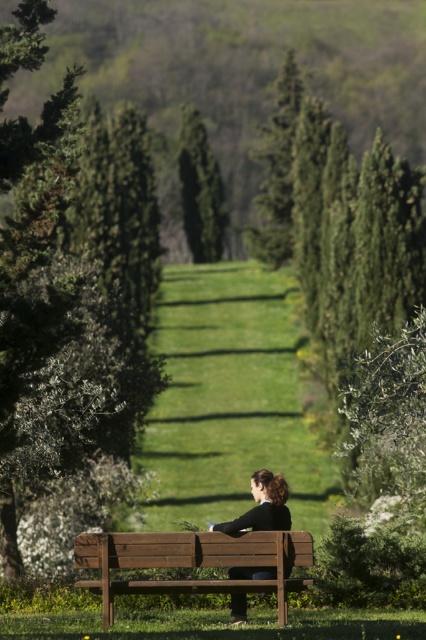
You are standing at the entrance of the grassy path and want to take a photo of the wooden bench at center and the green textured tree at center. Which object should you focus on first to ensure both are in clear view?

You should focus on the wooden bench at center first because it is closer to the viewer than the green textured tree at center, ensuring both are in clear view.

You are standing at the center of the grassy path in the park. You want to walk straight ahead towards the distant hillside. Will the green leafy tree at left block your path?

The green leafy tree at left is positioned at point (55, 326), which is to the left side of the path. Therefore, it will not block your straight path towards the distant hillside.

You are standing at the entrance of the garden and see the wooden bench at center and the green textured tree at center. Which object is positioned to the right side from your perspective?

The wooden bench at center is positioned to the right of the green textured tree at center, so the wooden bench at center is on the right side.